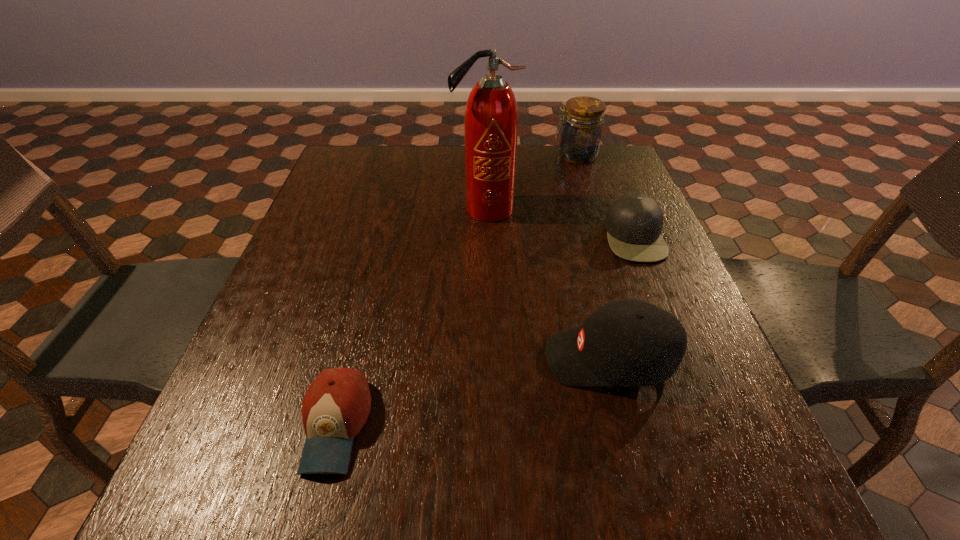
Where is `object present at the far edge`? object present at the far edge is located at coordinates (581, 133).

You are a GUI agent. You are given a task and a screenshot of the screen. Output one action in this format:
    pyautogui.click(x=<x>, y=<y>)
    Task: Click on the object that is at the near edge
    
    Given the screenshot: What is the action you would take?
    pyautogui.click(x=336, y=406)

At what (x,y) coordinates should I click in order to perform the action: click on object that is positioned at the left edge. Please return your answer as a coordinate pair (x, y). Looking at the image, I should click on (336, 406).

At what (x,y) coordinates should I click in order to perform the action: click on jar at the right edge. Please return your answer as a coordinate pair (x, y). Looking at the image, I should click on (581, 133).

You are a GUI agent. You are given a task and a screenshot of the screen. Output one action in this format:
    pyautogui.click(x=<x>, y=<y>)
    Task: Click on the baseball cap located at the right edge
    Image resolution: width=960 pixels, height=540 pixels.
    Given the screenshot: What is the action you would take?
    pyautogui.click(x=632, y=343)

Locate an element on the screen. cap that is positioned at the right edge is located at coordinates (634, 222).

Locate an element on the screen. object present at the near left corner is located at coordinates (336, 406).

The image size is (960, 540). I want to click on object positioned at the far right corner, so click(581, 133).

Locate an element on the screen. Image resolution: width=960 pixels, height=540 pixels. free point at the near edge is located at coordinates (302, 479).

The height and width of the screenshot is (540, 960). I want to click on free space at the left edge of the desktop, so click(x=318, y=213).